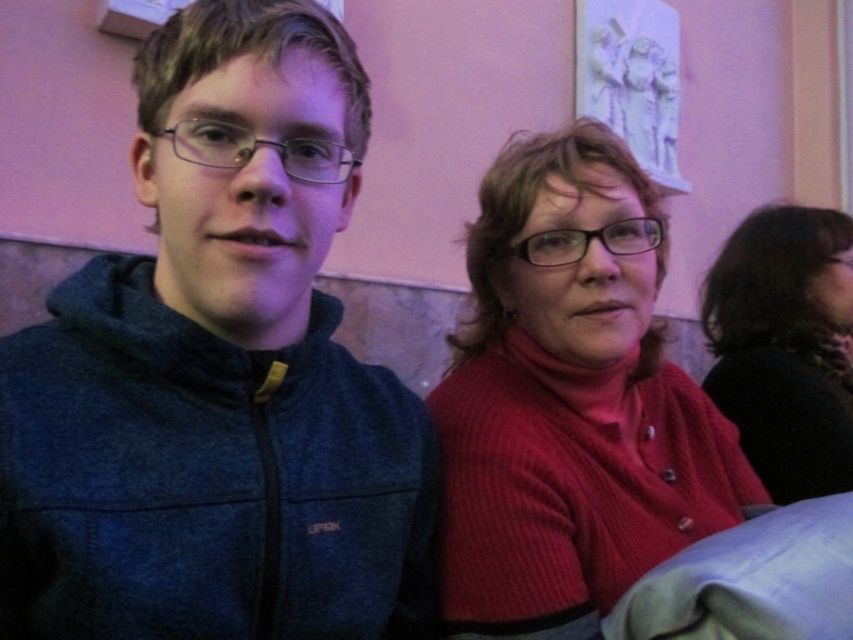
Question: Is dark blue fleece jacket at left positioned before black sweater at right?

Choices:
 (A) yes
 (B) no

Answer: (A)

Question: Which of the following is the closest to the observer?

Choices:
 (A) (805, 404)
 (B) (181, 97)

Answer: (B)

Question: Which object is farther from the camera taking this photo?

Choices:
 (A) black sweater at right
 (B) matte red sweater at center

Answer: (A)

Question: Which point is farther from the camera taking this photo?

Choices:
 (A) (834, 358)
 (B) (251, 81)

Answer: (A)

Question: Does dark blue fleece jacket at left have a lesser width compared to black sweater at right?

Choices:
 (A) no
 (B) yes

Answer: (A)

Question: Where is dark blue fleece jacket at left located in relation to matte red sweater at center in the image?

Choices:
 (A) above
 (B) below

Answer: (A)